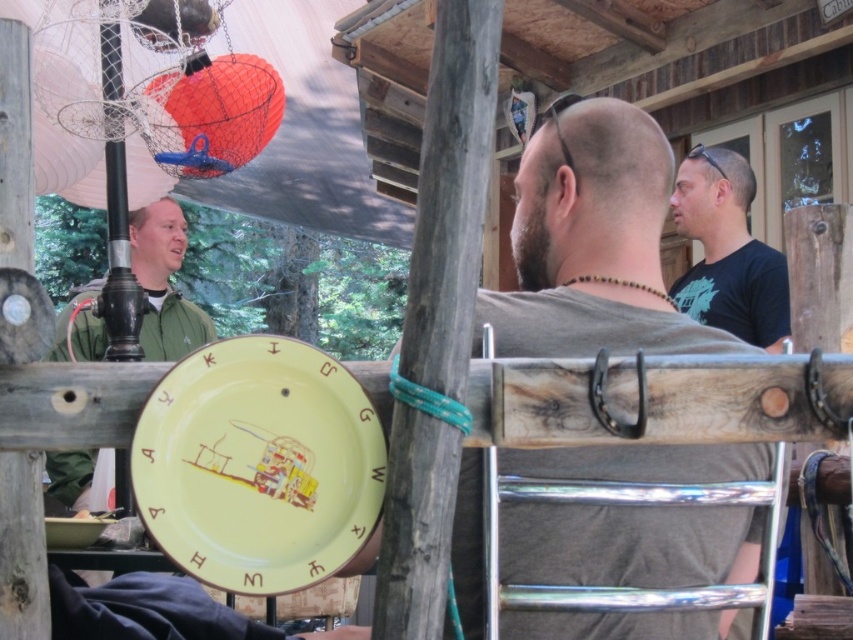
Question: Is green matte jacket at left wider than yellow matte plate at lower left?

Choices:
 (A) no
 (B) yes

Answer: (B)

Question: Which object appears closest to the camera in this image?

Choices:
 (A) yellow ceramic plate at center
 (B) gray fabric shirt at center
 (C) yellow matte plate at lower left
 (D) green matte jacket at left

Answer: (A)

Question: Does black matte t-shirt at upper right have a smaller size compared to green matte jacket at left?

Choices:
 (A) yes
 (B) no

Answer: (A)

Question: Which point appears closest to the camera in this image?

Choices:
 (A) (56, 499)
 (B) (704, 234)
 (C) (167, 477)
 (D) (61, 525)

Answer: (C)

Question: Among these points, which one is farthest from the camera?

Choices:
 (A) (747, 282)
 (B) (538, 196)

Answer: (A)

Question: Considering the relative positions of green matte jacket at left and yellow matte plate at lower left in the image provided, where is green matte jacket at left located with respect to yellow matte plate at lower left?

Choices:
 (A) above
 (B) below

Answer: (A)